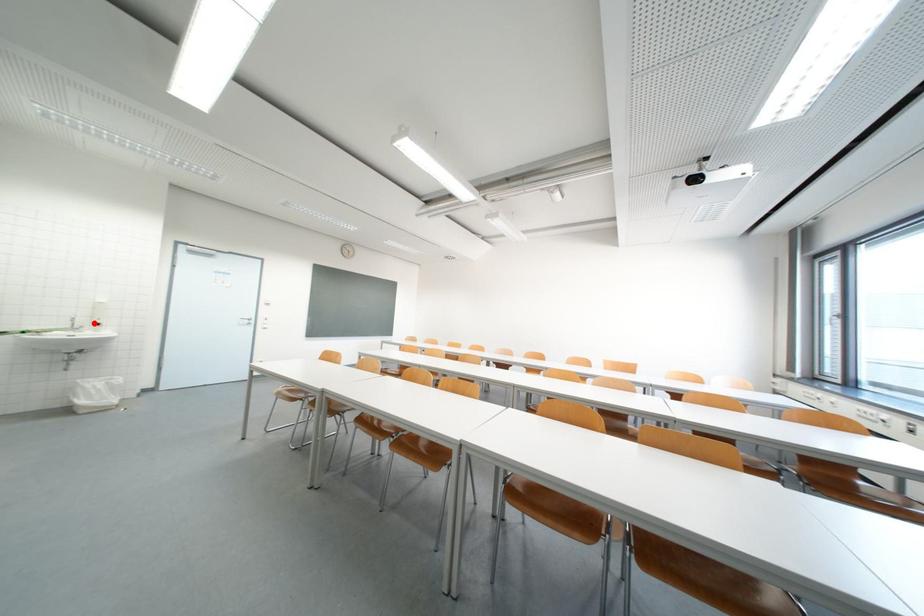
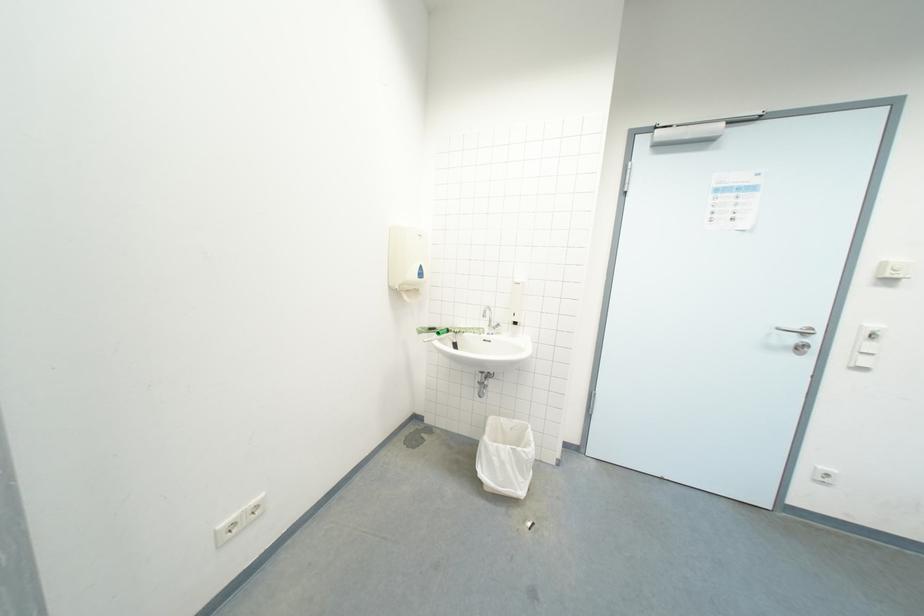
Question: I am providing you with two images of the same scene from different viewpoints. Image1 has a red point marked. In image2, the corresponding 3D location appears at what relative position? Reply with the corresponding letter.

Choices:
 (A) Closer
 (B) Farther

Answer: (B)